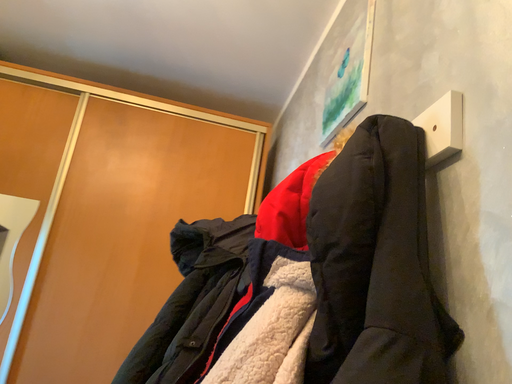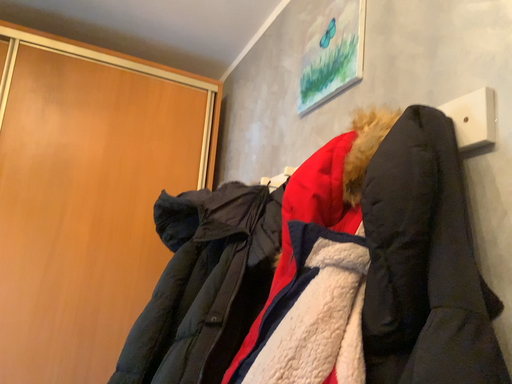
Question: Which way did the camera rotate in the video?

Choices:
 (A) rotated upward
 (B) rotated downward

Answer: (B)